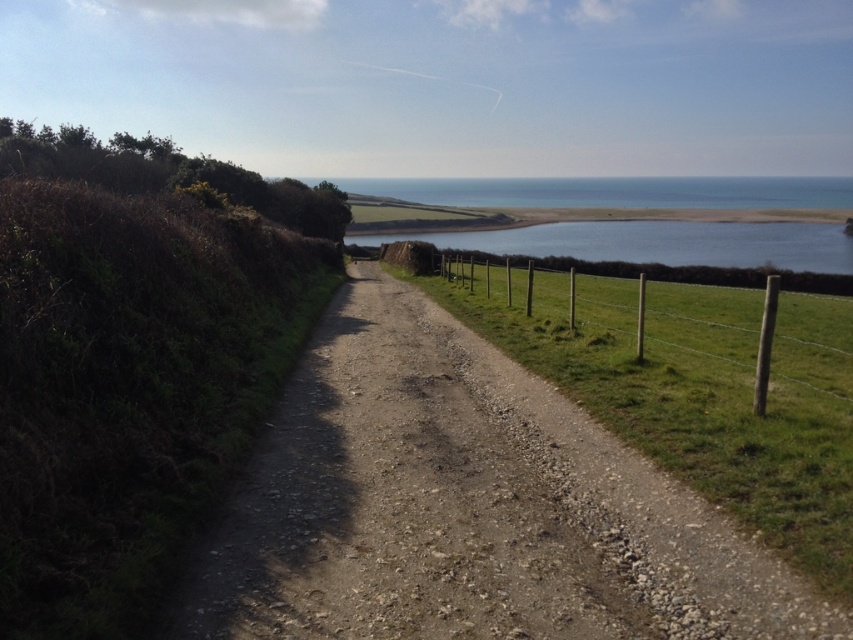
Question: Can you confirm if wooden post fence at right is smaller than blue water at center?

Choices:
 (A) no
 (B) yes

Answer: (B)

Question: Which point is closer to the camera taking this photo?

Choices:
 (A) (781, 481)
 (B) (695, 356)
 (C) (735, 262)

Answer: (A)

Question: Can you confirm if green grassy at right is smaller than wooden post fence at right?

Choices:
 (A) no
 (B) yes

Answer: (B)

Question: Which object is closer to the camera taking this photo?

Choices:
 (A) wooden post fence at right
 (B) green grassy at right

Answer: (B)

Question: Which point appears closest to the camera in this image?

Choices:
 (A) (693, 422)
 (B) (851, 385)

Answer: (A)

Question: Is green grassy at right smaller than blue water at center?

Choices:
 (A) no
 (B) yes

Answer: (B)